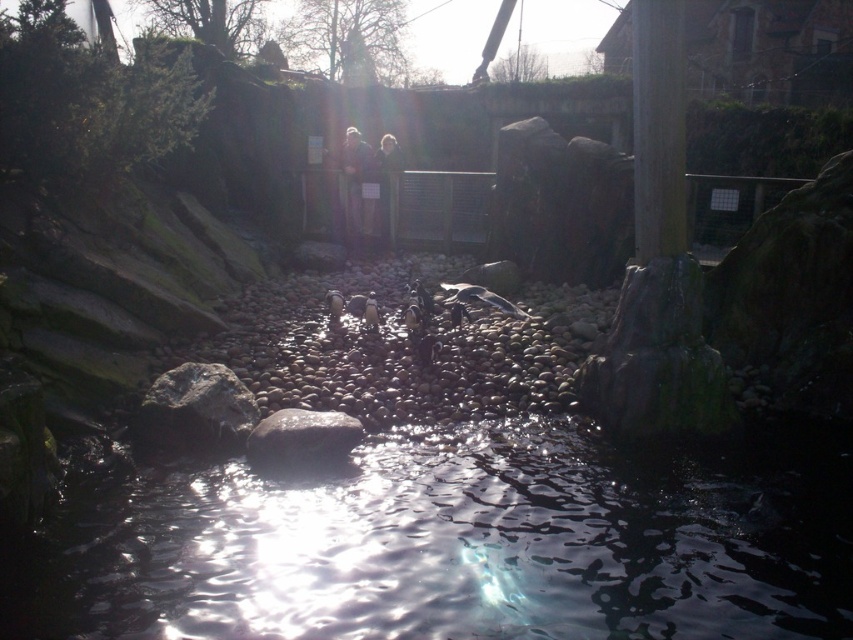
Question: From the image, what is the correct spatial relationship of transparent water at center in relation to smooth gray rock at center?

Choices:
 (A) above
 (B) below

Answer: (B)

Question: Observing the image, what is the correct spatial positioning of transparent water at center in reference to smooth gray rock at lower left?

Choices:
 (A) below
 (B) above

Answer: (A)

Question: Among these objects, which one is farthest from the camera?

Choices:
 (A) transparent water at center
 (B) smooth gray rock at lower left

Answer: (B)

Question: Among these points, which one is farthest from the camera?

Choices:
 (A) (80, 518)
 (B) (302, 422)
 (C) (227, 401)

Answer: (C)

Question: Considering the real-world distances, which object is farthest from the smooth gray rock at center?

Choices:
 (A) transparent water at center
 (B) smooth gray rock at lower left

Answer: (A)

Question: Is smooth gray rock at lower left wider than smooth gray rock at center?

Choices:
 (A) yes
 (B) no

Answer: (A)